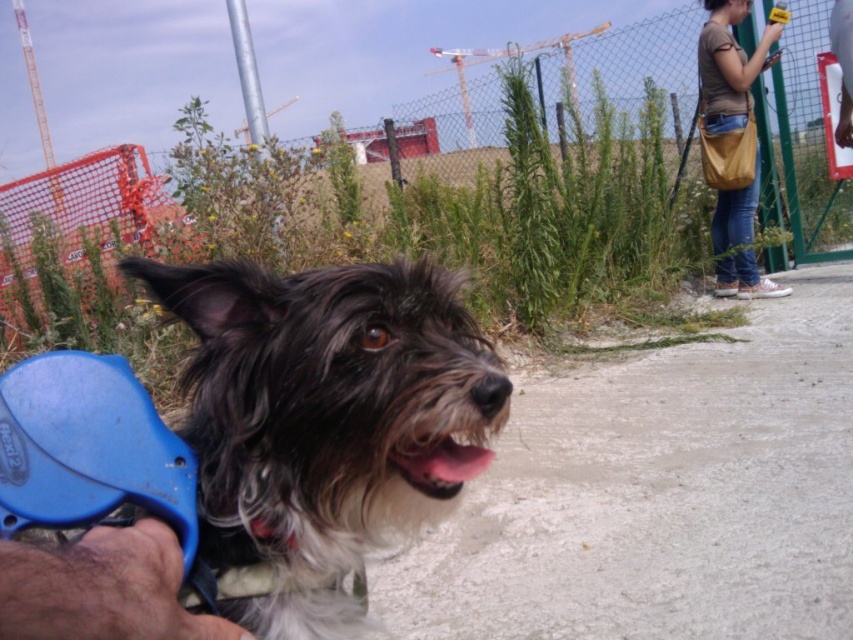
You are standing at the center of the image and want to walk towards the metal mesh fence at center. Which direction should you walk?

Since the metal mesh fence at center is already at the center of the image, you are already at the correct position and do not need to move.

You are trying to determine which dog is taller between the fuzzy black dog at center and the fuzzy fur dog at center. Based on the scene description, which one is taller?

The fuzzy black dog at center is taller than the fuzzy fur dog at center as stated in the objects description.

You are a photographer trying to capture both the fuzzy black dog at center and the fuzzy fur dog at center in a single frame. Given that your camera has a fixed focal length, which dog should you focus on to ensure both are in the frame without cropping?

The fuzzy black dog at center is larger in width than the fuzzy fur dog at center, so focusing on the larger dog would help keep both within the frame as the smaller dog can fit alongside without exceeding the frame limits.